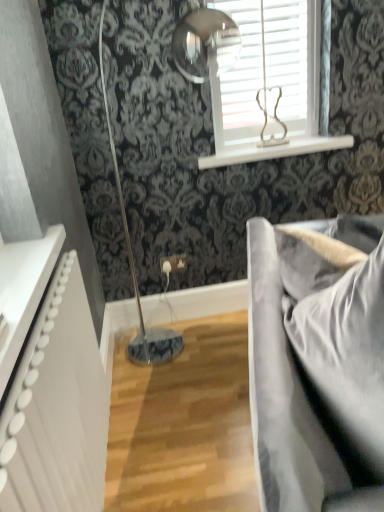
Question: Is white wooden blinds at upper center in front of or behind satin grey fabric couch at right in the image?

Choices:
 (A) behind
 (B) front

Answer: (A)

Question: In terms of width, does white wooden blinds at upper center look wider or thinner when compared to satin grey fabric couch at right?

Choices:
 (A) wide
 (B) thin

Answer: (B)

Question: Which object is positioned farthest from the white glossy window sill at upper center?

Choices:
 (A) white wooden blinds at upper center
 (B) white textured radiator at left
 (C) satin grey fabric couch at right

Answer: (B)

Question: Which object is positioned farthest from the white wooden blinds at upper center?

Choices:
 (A) white textured radiator at left
 (B) satin grey fabric couch at right
 (C) white glossy window sill at upper center

Answer: (A)